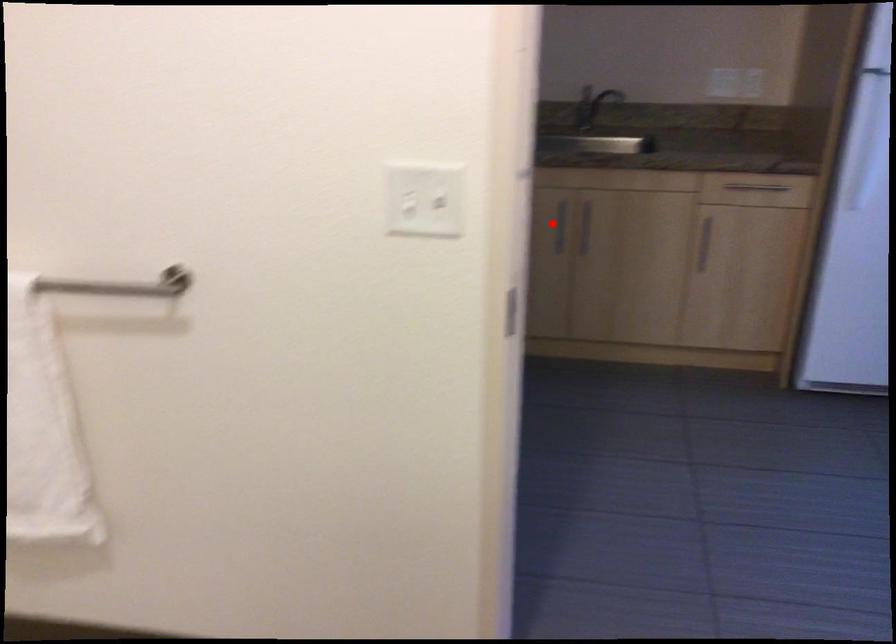
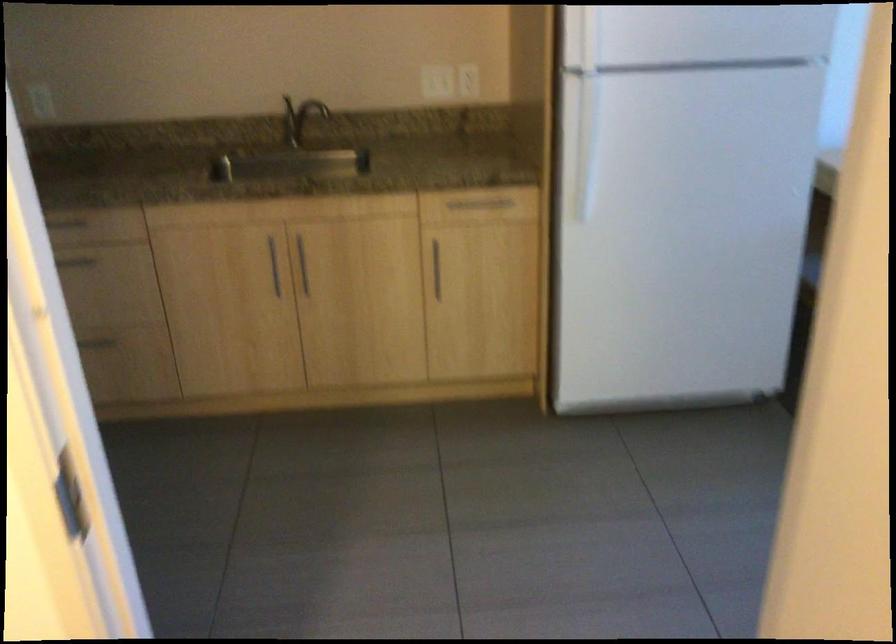
Question: I am providing you with two images of the same scene from different viewpoints. Image1 has a red point marked. In image2, the corresponding 3D location appears at what relative position? Reply with the corresponding letter.

Choices:
 (A) Closer
 (B) Farther

Answer: (A)